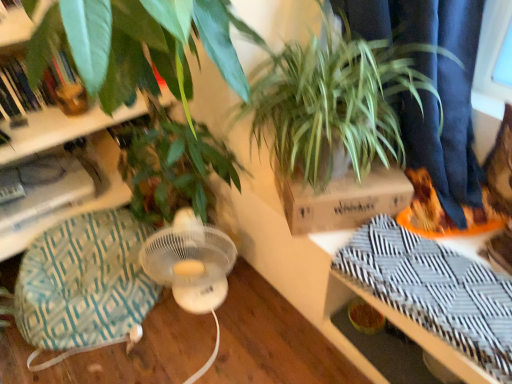
Locate an element on the screen. The width and height of the screenshot is (512, 384). free space in front of white plastic fan at lower left is located at coordinates pos(185,352).